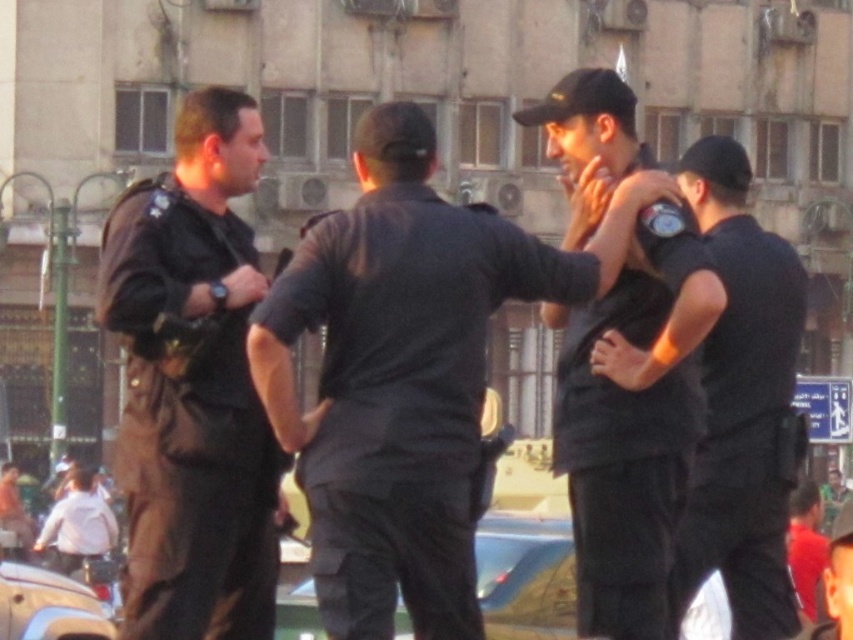
Question: Can you confirm if black matte shirt at right is positioned below white matte shirt at lower left?

Choices:
 (A) no
 (B) yes

Answer: (A)

Question: Can you confirm if black matte shirt at center is positioned above white matte shirt at lower left?

Choices:
 (A) yes
 (B) no

Answer: (A)

Question: Which of these objects is positioned closest to the black uniform at center?

Choices:
 (A) black matte shirt at right
 (B) white matte shirt at lower left
 (C) dark brown uniform at left
 (D) black matte shirt at center

Answer: (D)

Question: Can you confirm if black matte shirt at center is bigger than dark brown uniform at left?

Choices:
 (A) yes
 (B) no

Answer: (B)

Question: Among these objects, which one is farthest from the camera?

Choices:
 (A) black matte shirt at center
 (B) black uniform at center

Answer: (B)

Question: Which of the following is the closest to the observer?

Choices:
 (A) (497, 253)
 (B) (187, 305)
 (C) (77, 552)

Answer: (B)